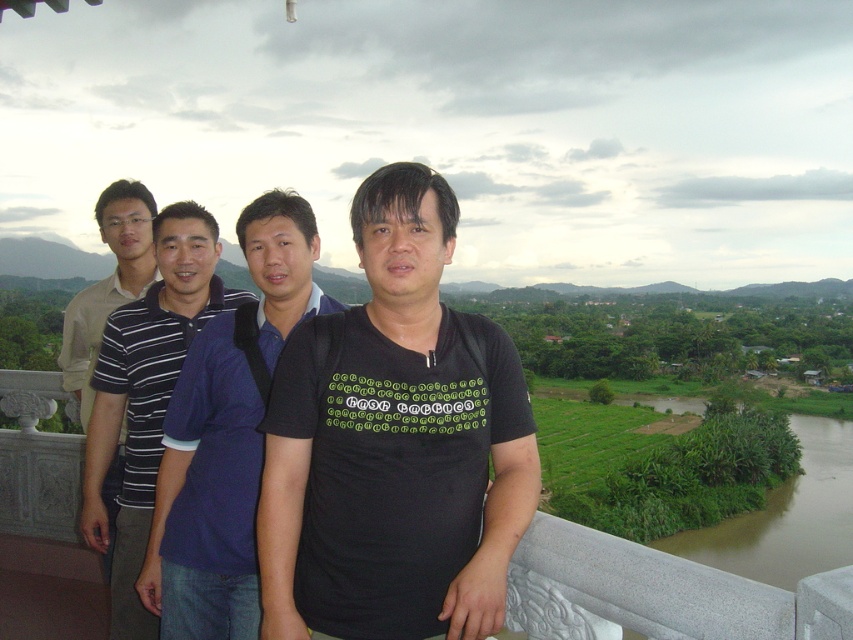
You are a photographer trying to capture a group photo of the blue cotton shirt at center and the striped cotton polo shirt at left. Based on their heights, which person should stand in the front row to ensure both are visible?

The blue cotton shirt at center has a lesser height compared to striped cotton polo shirt at left, so the blue cotton shirt at center should stand in the front row to ensure both are visible.

Consider the image. You are standing at the edge of the balcony and want to hand a document to the person wearing the dark blue polo shirt at center. If you can reach out 2 meters, will you be able to hand it to them directly?

The dark blue polo shirt at center is 3.76 meters away from the viewer. Since you can only reach out 2 meters, you cannot hand the document directly to them as the distance is greater than your reach.

You are a photographer trying to capture a group photo of the black matte shirt at center and the striped cotton polo shirt at left. Since you want to ensure both subjects are clearly visible, which subject should you focus on first to account for their sizes?

The black matte shirt at center has a lesser width compared to striped cotton polo shirt at left, so you should focus on the striped cotton polo shirt at left first since it is larger and might require more attention to capture details.